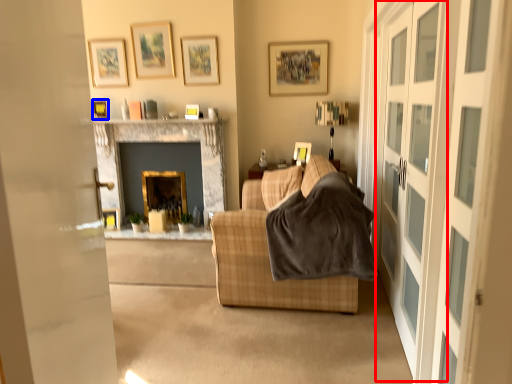
Question: Which of the following is the closest to the observer, screen door (highlighted by a red box) or picture frame (highlighted by a blue box)?

Choices:
 (A) screen door
 (B) picture frame

Answer: (A)